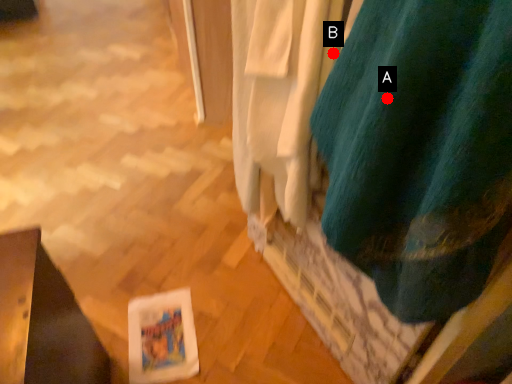
Question: Two points are circled on the image, labeled by A and B beside each circle. Which point is farther to the camera?

Choices:
 (A) A is further
 (B) B is further

Answer: (B)